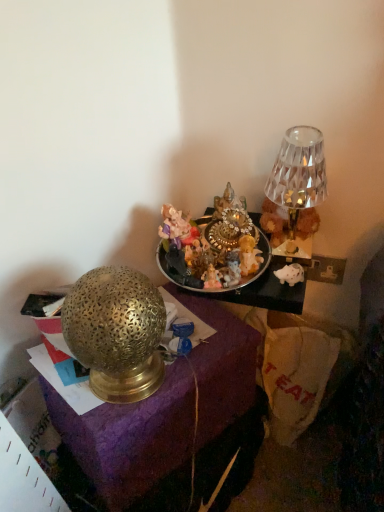
Question: Considering the relative sizes of shiny metallic tray at center and crystal glass lamp at upper right in the image provided, is shiny metallic tray at center taller than crystal glass lamp at upper right?

Choices:
 (A) yes
 (B) no

Answer: (B)

Question: Is shiny metallic tray at center turned away from crystal glass lamp at upper right?

Choices:
 (A) no
 (B) yes

Answer: (A)

Question: From a real-world perspective, is shiny metallic tray at center positioned over crystal glass lamp at upper right based on gravity?

Choices:
 (A) yes
 (B) no

Answer: (B)

Question: Is shiny metallic tray at center outside of crystal glass lamp at upper right?

Choices:
 (A) no
 (B) yes

Answer: (B)

Question: Does shiny metallic tray at center touch crystal glass lamp at upper right?

Choices:
 (A) yes
 (B) no

Answer: (B)

Question: Would you say shiny metallic tray at center is inside or outside gold textured lamp at left?

Choices:
 (A) outside
 (B) inside

Answer: (A)

Question: From the image's perspective, relative to gold textured lamp at left, is shiny metallic tray at center above or below?

Choices:
 (A) below
 (B) above

Answer: (B)

Question: In the image, is shiny metallic tray at center positioned in front of or behind gold textured lamp at left?

Choices:
 (A) behind
 (B) front

Answer: (A)

Question: Is point (168, 278) positioned closer to the camera than point (192, 384)?

Choices:
 (A) farther
 (B) closer

Answer: (A)

Question: Based on their sizes in the image, would you say shiny metallic tray at center is bigger or smaller than crystal glass lamp at upper right?

Choices:
 (A) small
 (B) big

Answer: (A)

Question: From their relative heights in the image, would you say shiny metallic tray at center is taller or shorter than crystal glass lamp at upper right?

Choices:
 (A) short
 (B) tall

Answer: (A)

Question: Based on their positions, is shiny metallic tray at center located to the left or right of crystal glass lamp at upper right?

Choices:
 (A) right
 (B) left

Answer: (B)

Question: Is shiny metallic tray at center wider or thinner than crystal glass lamp at upper right?

Choices:
 (A) thin
 (B) wide

Answer: (B)

Question: From the image's perspective, is gold textured lamp at left positioned above or below crystal glass lamp at upper right?

Choices:
 (A) below
 (B) above

Answer: (A)

Question: From their relative heights in the image, would you say gold textured lamp at left is taller or shorter than crystal glass lamp at upper right?

Choices:
 (A) tall
 (B) short

Answer: (A)